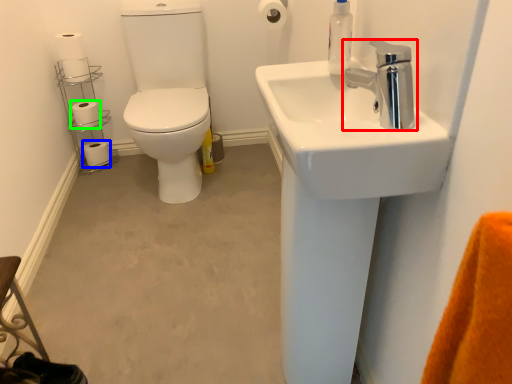
Question: Estimate the real-world distances between objects in this image. Which object is closer to tap (highlighted by a red box), toilet paper (highlighted by a blue box) or toilet paper (highlighted by a green box)?

Choices:
 (A) toilet paper
 (B) toilet paper

Answer: (B)